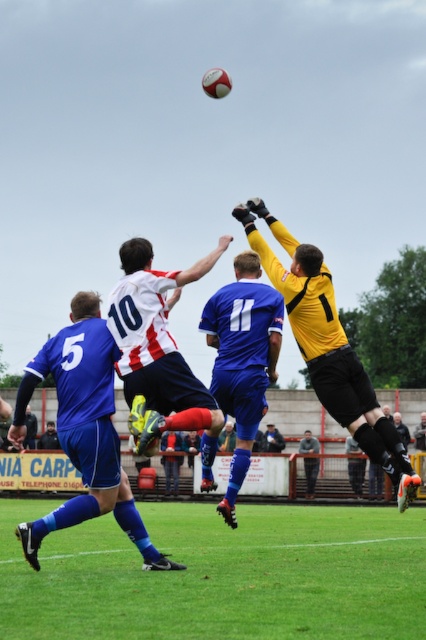
Question: Is green grass at lower center bigger than blue jersey at center?

Choices:
 (A) yes
 (B) no

Answer: (A)

Question: Which point is closer to the camera taking this photo?

Choices:
 (A) (302, 442)
 (B) (348, 609)
 (C) (181, 278)
 (D) (256, 209)

Answer: (B)

Question: Estimate the real-world distances between objects in this image. Which object is closer to the blue fabric shorts at center?

Choices:
 (A) white striped jersey at center
 (B) gray fabric jacket at center

Answer: (A)

Question: In this image, where is yellow jersey at center located relative to blue jersey at center?

Choices:
 (A) left
 (B) right

Answer: (B)

Question: Which object is closer to the camera taking this photo?

Choices:
 (A) yellow jersey at center
 (B) blue fabric shorts at center

Answer: (B)

Question: Does blue fabric shorts at center have a lesser width compared to yellow jersey at center?

Choices:
 (A) yes
 (B) no

Answer: (B)